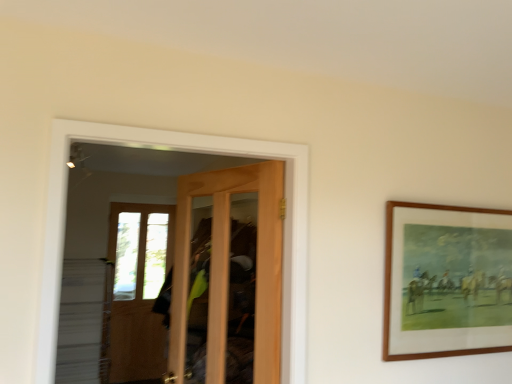
This screenshot has height=384, width=512. Identify the location of light brown wooden door at center. tap(227, 277).

The image size is (512, 384). What do you see at coordinates (227, 277) in the screenshot? I see `light brown wooden door at center` at bounding box center [227, 277].

The image size is (512, 384). What do you see at coordinates (446, 281) in the screenshot?
I see `wooden framed painting at upper right` at bounding box center [446, 281].

I want to click on wooden framed painting at upper right, so click(x=446, y=281).

Find the location of `light brown wooden door at center`. light brown wooden door at center is located at coordinates (x=227, y=277).

Considering the positions of objects wooden framed painting at upper right and light brown wooden door at center in the image provided, who is more to the right, wooden framed painting at upper right or light brown wooden door at center?

From the viewer's perspective, wooden framed painting at upper right appears more on the right side.

Is the position of wooden framed painting at upper right less distant than that of light brown wooden door at center?

No, wooden framed painting at upper right is further to the viewer.

Is point (463, 345) positioned after point (188, 232)?

No.

Based on the photo, from the image's perspective, which one is positioned higher, wooden framed painting at upper right or light brown wooden door at center?

From the image's view, wooden framed painting at upper right is above.

From a real-world perspective, which is physically above, wooden framed painting at upper right or light brown wooden door at center?

From a 3D spatial view, wooden framed painting at upper right is above.

Which object is wider, wooden framed painting at upper right or light brown wooden door at center?

light brown wooden door at center.

Can you confirm if wooden framed painting at upper right is taller than light brown wooden door at center?

In fact, wooden framed painting at upper right may be shorter than light brown wooden door at center.

Considering the sizes of wooden framed painting at upper right and light brown wooden door at center in the image, is wooden framed painting at upper right bigger or smaller than light brown wooden door at center?

wooden framed painting at upper right is smaller than light brown wooden door at center.

Would you say wooden framed painting at upper right is outside light brown wooden door at center?

wooden framed painting at upper right is positioned outside light brown wooden door at center.

Is wooden framed painting at upper right far from light brown wooden door at center?

No, wooden framed painting at upper right is not far from light brown wooden door at center.

Is wooden framed painting at upper right oriented away from light brown wooden door at center?

No, wooden framed painting at upper right is not facing the opposite direction of light brown wooden door at center.

How much distance is there between wooden framed painting at upper right and light brown wooden door at center?

A distance of 36.28 inches exists between wooden framed painting at upper right and light brown wooden door at center.

You are a GUI agent. You are given a task and a screenshot of the screen. Output one action in this format:
    pyautogui.click(x=<x>, y=<y>)
    Task: Click on the door beneath the wooden framed painting at upper right (from a real-world perspective)
    
    Given the screenshot: What is the action you would take?
    pyautogui.click(x=227, y=277)

Which object is positioned more to the right, light brown wooden door at center or wooden framed painting at upper right?

From the viewer's perspective, wooden framed painting at upper right appears more on the right side.

In the image, is light brown wooden door at center positioned in front of or behind wooden framed painting at upper right?

light brown wooden door at center is in front of wooden framed painting at upper right.

Which point is more forward, (250,196) or (487,337)?

The point (487,337) is in front.

From the image's perspective, is light brown wooden door at center under wooden framed painting at upper right?

Indeed, from the image's perspective, light brown wooden door at center is shown beneath wooden framed painting at upper right.

From a real-world perspective, who is located lower, light brown wooden door at center or wooden framed painting at upper right?

light brown wooden door at center, from a real-world perspective.

Which object is wider, light brown wooden door at center or wooden framed painting at upper right?

light brown wooden door at center.

In terms of height, does light brown wooden door at center look taller or shorter compared to wooden framed painting at upper right?

Result: Considering their sizes, light brown wooden door at center has more height than wooden framed painting at upper right.

From the picture: Who is smaller, light brown wooden door at center or wooden framed painting at upper right?

Smaller between the two is wooden framed painting at upper right.

Is light brown wooden door at center located outside wooden framed painting at upper right?

light brown wooden door at center is positioned outside wooden framed painting at upper right.

Is light brown wooden door at center next to wooden framed painting at upper right and touching it?

No, light brown wooden door at center is not with wooden framed painting at upper right.

Based on the photo, is light brown wooden door at center oriented away from wooden framed painting at upper right?

No, light brown wooden door at center is not facing away from wooden framed painting at upper right.

Where is `door on the left of wooden framed painting at upper right`? door on the left of wooden framed painting at upper right is located at coordinates (227, 277).

You are a GUI agent. You are given a task and a screenshot of the screen. Output one action in this format:
    pyautogui.click(x=<x>, y=<y>)
    Task: Click on the door located on the left of wooden framed painting at upper right
    The width and height of the screenshot is (512, 384).
    Given the screenshot: What is the action you would take?
    pyautogui.click(x=227, y=277)

Where is `door lying below the wooden framed painting at upper right (from the image's perspective)`? Image resolution: width=512 pixels, height=384 pixels. door lying below the wooden framed painting at upper right (from the image's perspective) is located at coordinates (227, 277).